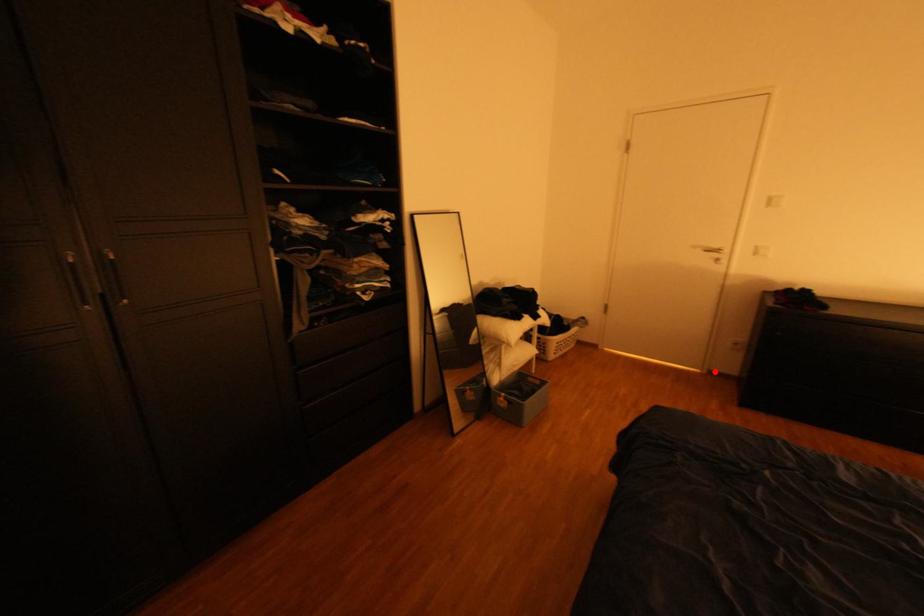
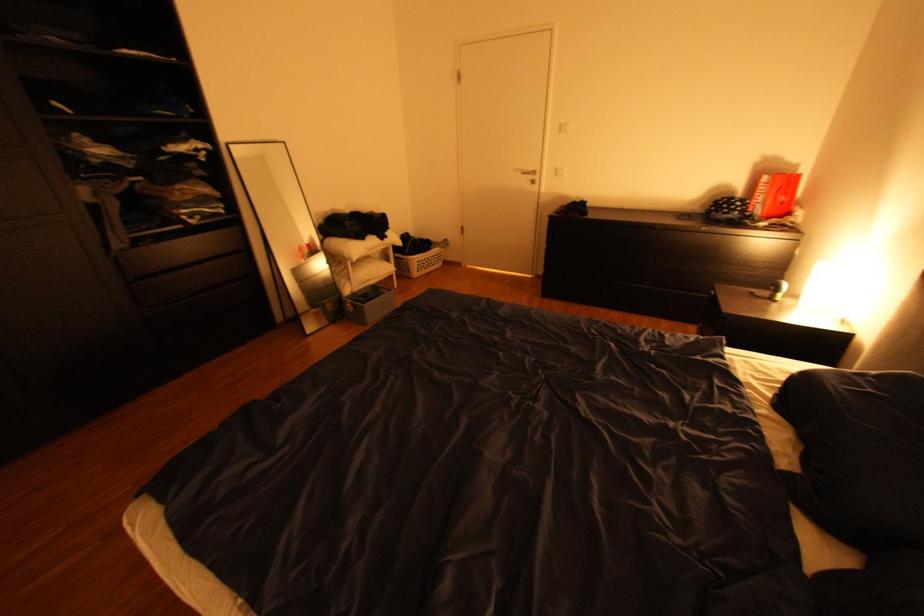
In the second image, find the point that corresponds to the highlighted location in the first image.

(543, 276)